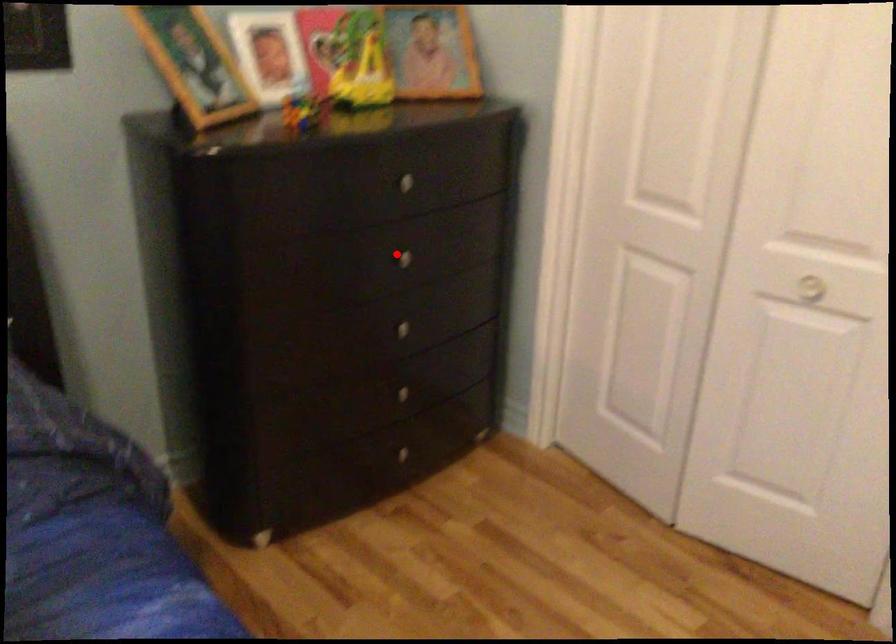
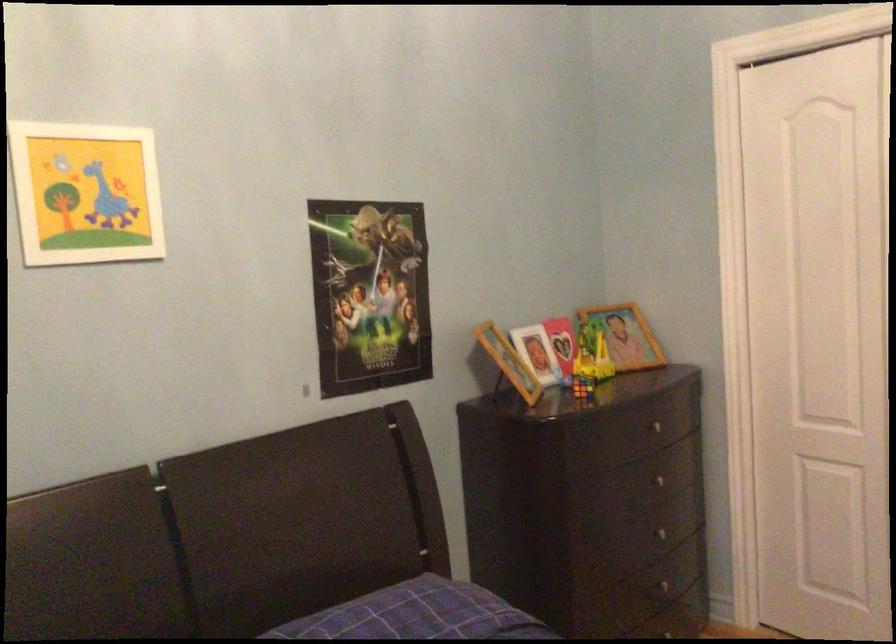
Question: A red point is marked in image1. In image2, is the corresponding 3D point closer to the camera or farther? Reply with the corresponding letter.

Choices:
 (A) The corresponding 3D point is closer.
 (B) The corresponding 3D point is farther.

Answer: (B)